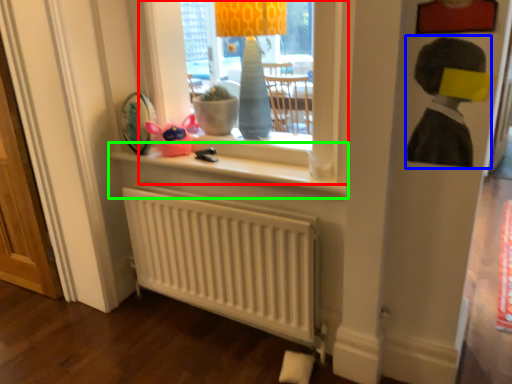
Question: Based on their relative distances, which object is farther from window (highlighted by a red box)? Choose from person (highlighted by a blue box) and window sill (highlighted by a green box).

Choices:
 (A) person
 (B) window sill

Answer: (B)